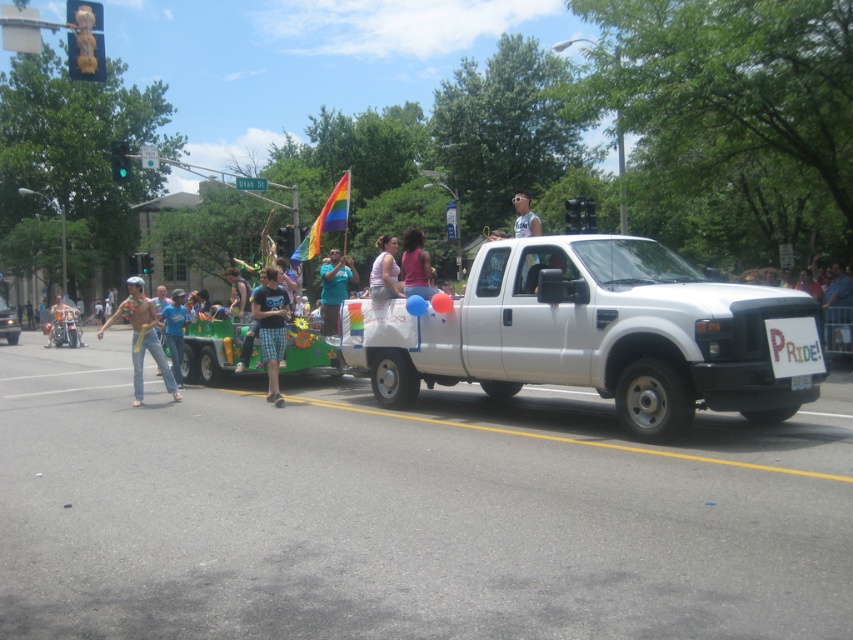
You are attending the Pride parade and see two people in the crowd. One is wearing denim jeans at left and another is wearing a pink fabric shirt at center. Which person is positioned more to the left side of the image?

The denim jeans at left is positioned to the left of the pink fabric shirt at center, so the person wearing denim jeans at left is more to the left side of the image.

You are a photographer at the Pride parade. You want to take a photo that includes both the denim jeans at left and the blue cotton shirt at center. Which object should you focus on first to ensure both are in the frame?

You should focus on the denim jeans at left first because it is in front of the blue cotton shirt at center, ensuring both will be captured in the frame.

You are a photographer at the Pride parade. You want to capture a photo of the white pickup truck and the float being pulled by it. However, there is an obstacle blocking your view. The obstacle is located at point (x=142, y=337), which is the denim jeans at left. Can you still take the photo without moving your position?

The denim jeans at left are located at point (x=142, y=337), which might block your view of the float. To ensure the white pickup truck and the float are visible, you may need to adjust your angle or move slightly to avoid the obstruction caused by the denim jeans at left.